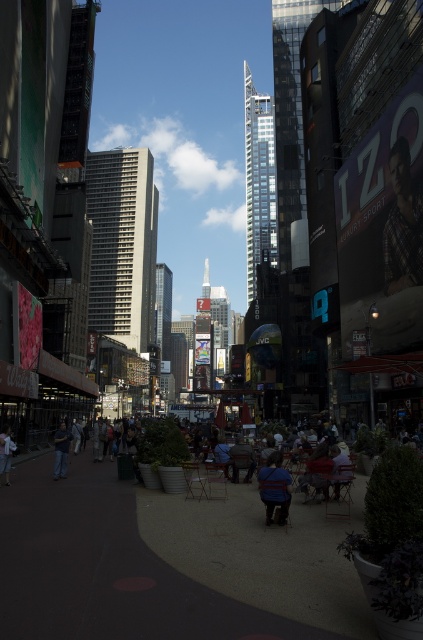
Is denim jeans at left thinner than light blue denim jeans at lower left?

Indeed, denim jeans at left has a lesser width compared to light blue denim jeans at lower left.

Can you confirm if denim jeans at left is shorter than light blue denim jeans at lower left?

Yes, denim jeans at left is shorter than light blue denim jeans at lower left.

In order to click on denim jeans at left in this screenshot , I will do `click(60, 451)`.

Does glassy steel tower at center appear on the right side of blue fabric shirt at center?

Indeed, glassy steel tower at center is positioned on the right side of blue fabric shirt at center.

Can you confirm if glassy steel tower at center is shorter than blue fabric shirt at center?

No.

The image size is (423, 640). What do you see at coordinates (258, 180) in the screenshot?
I see `glassy steel tower at center` at bounding box center [258, 180].

Where is `glassy steel tower at center`? glassy steel tower at center is located at coordinates (258, 180).

Does glassy skyscraper at center have a greater height compared to light blue denim jeans at lower left?

Indeed, glassy skyscraper at center has a greater height compared to light blue denim jeans at lower left.

Identify the location of glassy skyscraper at center. (x=162, y=308).

At what (x,y) coordinates should I click in order to perform the action: click on glassy skyscraper at center. Please return your answer as a coordinate pair (x, y). The image size is (423, 640). Looking at the image, I should click on (162, 308).